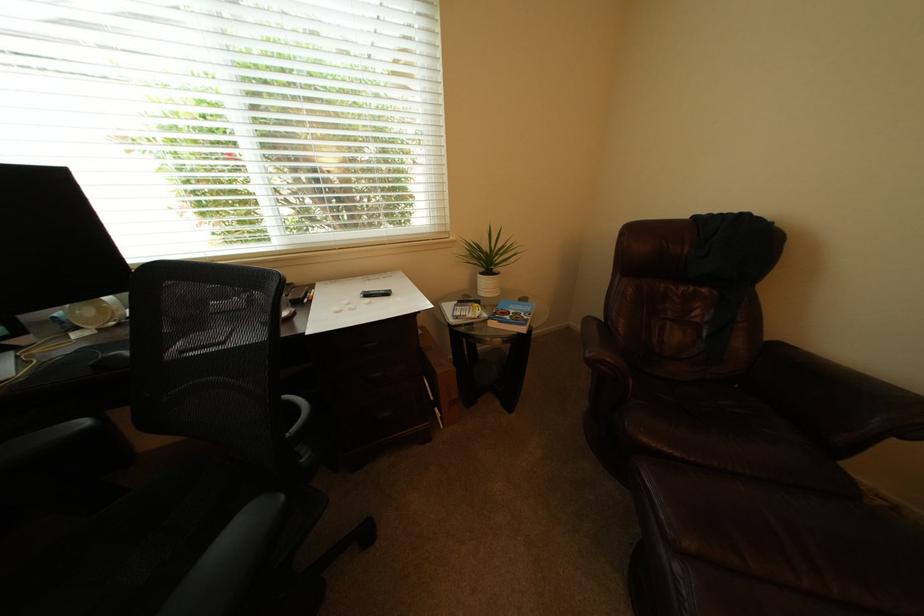
Find the location of a particular element. brown leather armrest is located at coordinates (600, 347).